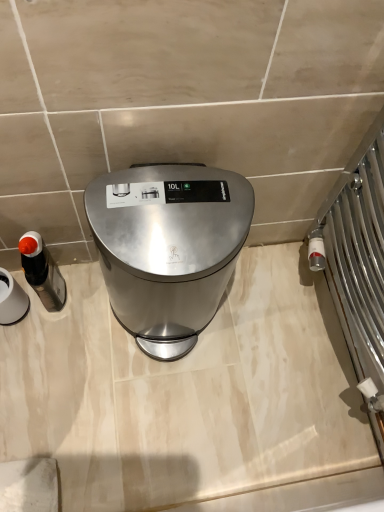
Question: Does point (3, 312) appear closer or farther from the camera than point (29, 258)?

Choices:
 (A) farther
 (B) closer

Answer: (A)

Question: Is matte black soap dispenser at left, which ranks as the second appliance in right-to-left order, bigger or smaller than matte black soap dispenser at left, which appears as the first appliance when viewed from the right?

Choices:
 (A) big
 (B) small

Answer: (A)

Question: Which is farther from the matte black soap dispenser at left, the 1th appliance in the left-to-right sequence?

Choices:
 (A) satin silver trash can at center
 (B) matte black soap dispenser at left, positioned as the 2th appliance in left-to-right order

Answer: (A)

Question: Which of these objects is positioned closest to the satin silver trash can at center?

Choices:
 (A) matte black soap dispenser at left, which appears as the first appliance when viewed from the right
 (B) matte black soap dispenser at left, which ranks as the second appliance in right-to-left order

Answer: (A)